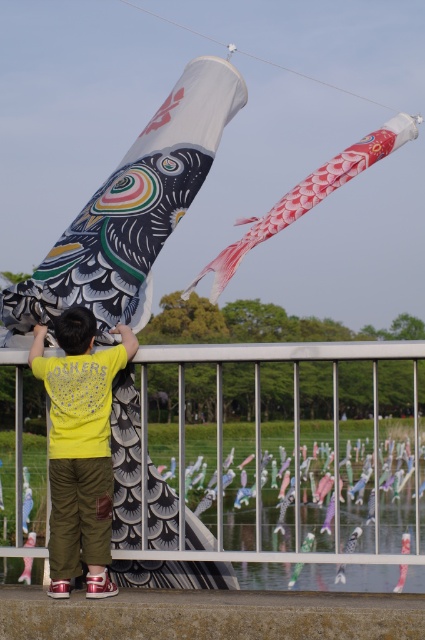
Looking at this image, is metallic silver fence at lower center further to the viewer compared to red textured fabric kite at upper center?

No, it is in front of red textured fabric kite at upper center.

Is metallic silver fence at lower center smaller than red textured fabric kite at upper center?

Actually, metallic silver fence at lower center might be larger than red textured fabric kite at upper center.

Which is in front, point (337, 499) or point (379, 136)?

Point (337, 499) is in front.

Find the location of a particular element. The image size is (425, 640). metallic silver fence at lower center is located at coordinates (260, 435).

Is yellow cotton shirt at center in front of red textured fabric kite at upper center?

Yes, it is in front of red textured fabric kite at upper center.

Does point (91, 458) come behind point (226, 252)?

That is False.

Find the location of a particular element. The width and height of the screenshot is (425, 640). yellow cotton shirt at center is located at coordinates (79, 448).

Between point (240, 342) and point (82, 376), which one is positioned behind?

Point (240, 342)

Who is more forward, (419, 346) or (87, 433)?

Point (87, 433) is more forward.

You are a GUI agent. You are given a task and a screenshot of the screen. Output one action in this format:
    pyautogui.click(x=<x>, y=<y>)
    Task: Click on the metallic silver fence at lower center
    This screenshot has width=425, height=640.
    Given the screenshot: What is the action you would take?
    pyautogui.click(x=260, y=435)

Locate an element on the screen. metallic silver fence at lower center is located at coordinates (260, 435).